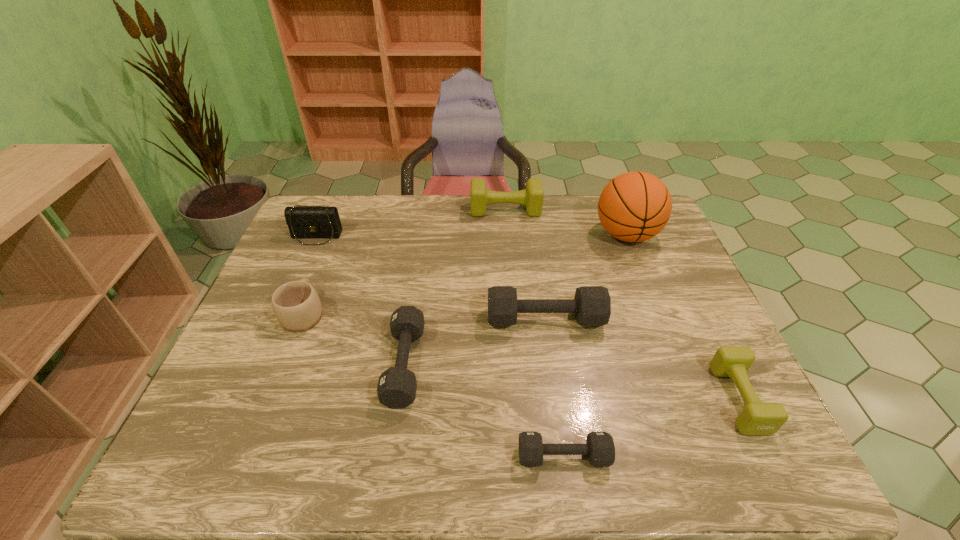
The image size is (960, 540). In order to click on basketball in this screenshot , I will do `click(635, 206)`.

Where is `the tallest object`? This screenshot has height=540, width=960. the tallest object is located at coordinates (635, 206).

Where is `the bigger olive dumbbell`? This screenshot has height=540, width=960. the bigger olive dumbbell is located at coordinates click(532, 197).

Identify the location of the left olive dumbbell. (532, 197).

Where is `clutch bag`? This screenshot has width=960, height=540. clutch bag is located at coordinates click(x=312, y=222).

The height and width of the screenshot is (540, 960). I want to click on the biggest gray dumbbell, so click(x=592, y=304).

Where is `mug`? mug is located at coordinates (296, 305).

Where is `the second smallest gray dumbbell`? The image size is (960, 540). the second smallest gray dumbbell is located at coordinates (397, 386).

Where is `the leftmost dumbbell`? This screenshot has height=540, width=960. the leftmost dumbbell is located at coordinates 397,386.

Where is `the nearer olive dumbbell`? The image size is (960, 540). the nearer olive dumbbell is located at coordinates (757, 418).